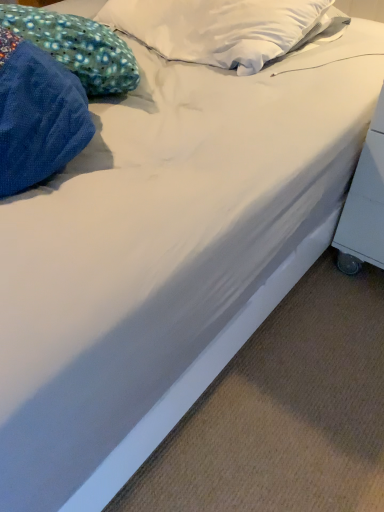
This screenshot has width=384, height=512. What do you see at coordinates (364, 204) in the screenshot?
I see `white plastic table at lower right` at bounding box center [364, 204].

You are a GUI agent. You are given a task and a screenshot of the screen. Output one action in this format:
    pyautogui.click(x=<x>, y=<y>)
    Task: Click on the white plastic table at lower right
    The width and height of the screenshot is (384, 512).
    Given the screenshot: What is the action you would take?
    pyautogui.click(x=364, y=204)

Describe the element at coordinates (77, 47) in the screenshot. I see `blue dotted fabric pillow at upper left` at that location.

Locate an element on the screen. The height and width of the screenshot is (512, 384). blue dotted fabric pillow at upper left is located at coordinates (77, 47).

You are a GUI agent. You are given a task and a screenshot of the screen. Output one action in this format:
    pyautogui.click(x=<x>, y=<y>)
    Task: Click on the white plastic table at lower right
    This screenshot has width=384, height=512.
    Given the screenshot: What is the action you would take?
    click(364, 204)

Which object is positioned more to the right, white plastic table at lower right or blue dotted fabric pillow at upper left?

white plastic table at lower right is more to the right.

Does white plastic table at lower right lie behind blue dotted fabric pillow at upper left?

No, white plastic table at lower right is closer to the camera.

Which is nearer, (377,241) or (51,22)?

The point (51,22) is closer.

From the image's perspective, between white plastic table at lower right and blue dotted fabric pillow at upper left, who is located below?

white plastic table at lower right is shown below in the image.

From a real-world perspective, relative to blue dotted fabric pillow at upper left, is white plastic table at lower right vertically above or below?

Clearly, from a real-world perspective, white plastic table at lower right is above blue dotted fabric pillow at upper left.

Which object is thinner, white plastic table at lower right or blue dotted fabric pillow at upper left?

blue dotted fabric pillow at upper left is thinner.

Who is shorter, white plastic table at lower right or blue dotted fabric pillow at upper left?

With less height is blue dotted fabric pillow at upper left.

Which of these two, white plastic table at lower right or blue dotted fabric pillow at upper left, is bigger?

blue dotted fabric pillow at upper left.

Is blue dotted fabric pillow at upper left located within white plastic table at lower right?

Actually, blue dotted fabric pillow at upper left is outside white plastic table at lower right.

Are white plastic table at lower right and blue dotted fabric pillow at upper left far apart?

white plastic table at lower right is actually quite close to blue dotted fabric pillow at upper left.

Is white plastic table at lower right oriented away from blue dotted fabric pillow at upper left?

No, blue dotted fabric pillow at upper left is not at the back of white plastic table at lower right.

What are the coordinates of `pillow above the white plastic table at lower right (from the image's perspective)` in the screenshot? It's located at tap(77, 47).

Which object is positioned more to the left, blue dotted fabric pillow at upper left or white plastic table at lower right?

From the viewer's perspective, blue dotted fabric pillow at upper left appears more on the left side.

In the scene shown: Considering the positions of objects blue dotted fabric pillow at upper left and white plastic table at lower right in the image provided, who is in front, blue dotted fabric pillow at upper left or white plastic table at lower right?

white plastic table at lower right is in front.

Does point (102, 89) come farther from viewer compared to point (382, 109)?

No, it is not.

From the image's perspective, which object appears higher, blue dotted fabric pillow at upper left or white plastic table at lower right?

blue dotted fabric pillow at upper left appears higher in the image.

From a real-world perspective, between blue dotted fabric pillow at upper left and white plastic table at lower right, who is vertically higher?

white plastic table at lower right.

Which object is thinner, blue dotted fabric pillow at upper left or white plastic table at lower right?

With smaller width is blue dotted fabric pillow at upper left.

Between blue dotted fabric pillow at upper left and white plastic table at lower right, which one has less height?

Standing shorter between the two is blue dotted fabric pillow at upper left.

Between blue dotted fabric pillow at upper left and white plastic table at lower right, which one has larger size?

Bigger between the two is blue dotted fabric pillow at upper left.

Is white plastic table at lower right a part of blue dotted fabric pillow at upper left?

No, white plastic table at lower right is not a part of blue dotted fabric pillow at upper left.

Are blue dotted fabric pillow at upper left and white plastic table at lower right located far from each other?

No.

Is blue dotted fabric pillow at upper left facing away from white plastic table at lower right?

No, blue dotted fabric pillow at upper left's orientation is not away from white plastic table at lower right.

Find the location of `pillow on the left side of white plastic table at lower right`. pillow on the left side of white plastic table at lower right is located at coordinates (77, 47).

The height and width of the screenshot is (512, 384). I want to click on pillow directly beneath the white plastic table at lower right (from a real-world perspective), so click(x=77, y=47).

This screenshot has height=512, width=384. I want to click on table lying below the blue dotted fabric pillow at upper left (from the image's perspective), so click(364, 204).